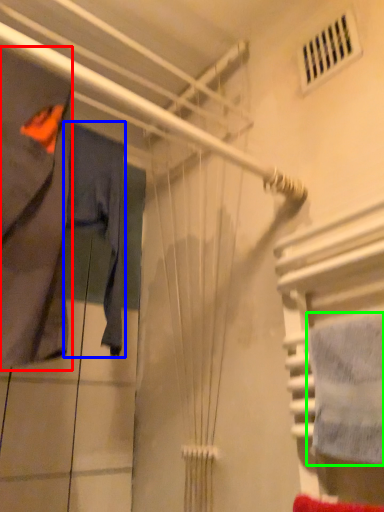
Question: Based on their relative distances, which object is farther from clothing (highlighted by a red box)? Choose from clothing (highlighted by a blue box) and towel (highlighted by a green box).

Choices:
 (A) clothing
 (B) towel

Answer: (B)